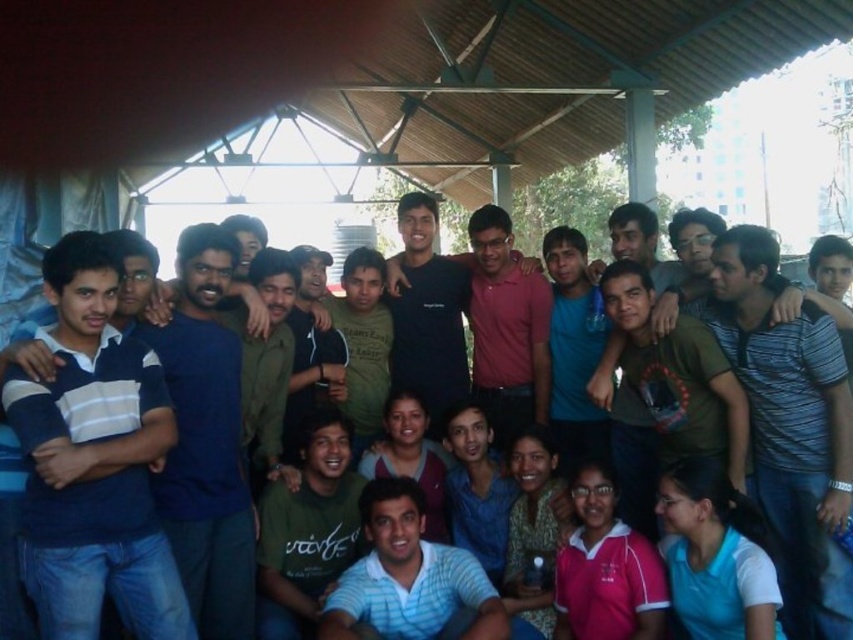
Between dark blue t-shirt at center and green matte shirt at center, which one has less height?

green matte shirt at center is shorter.

Is dark blue t-shirt at center below green matte shirt at center?

Incorrect, dark blue t-shirt at center is not positioned below green matte shirt at center.

I want to click on dark blue t-shirt at center, so click(206, 442).

Does white striped polo shirt at center come in front of green matte shirt at center?

Yes, it is in front of green matte shirt at center.

At what (x,y) coordinates should I click in order to perform the action: click on white striped polo shirt at center. Please return your answer as a coordinate pair (x, y). This screenshot has width=853, height=640. Looking at the image, I should click on (407, 576).

Does dark blue t-shirt at center have a lesser width compared to white striped polo shirt at center?

Yes.

Which is more to the right, dark blue t-shirt at center or white striped polo shirt at center?

Positioned to the right is white striped polo shirt at center.

Does point (206, 406) come farther from viewer compared to point (450, 556)?

No, it is in front of (450, 556).

Identify the location of dark blue t-shirt at center. (206, 442).